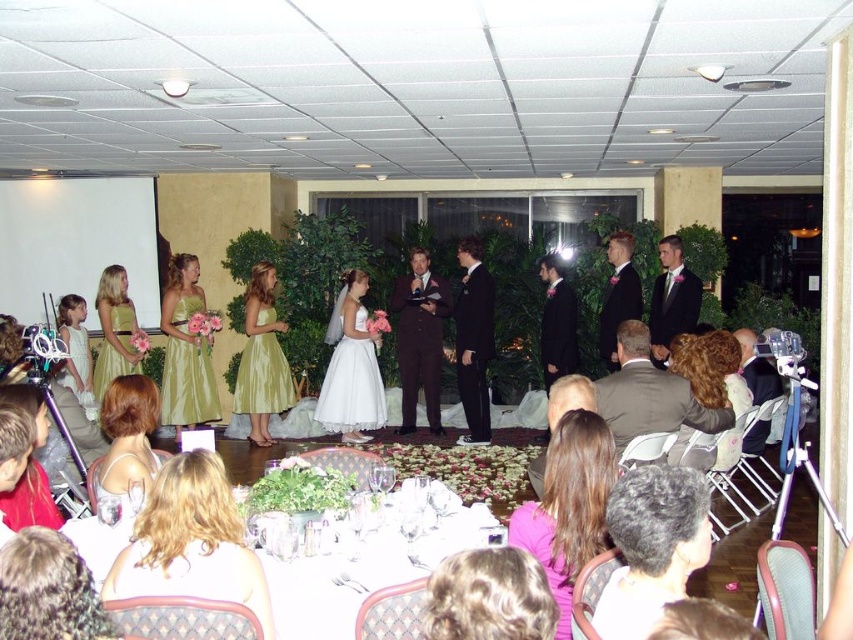
Which is below, matte black suit at center or shiny gold dress at center?

Positioned lower is shiny gold dress at center.

Which is more to the right, matte black suit at center or shiny gold dress at center?

Positioned to the right is matte black suit at center.

Does point (676, 288) come farther from viewer compared to point (102, 275)?

No.

This screenshot has height=640, width=853. I want to click on matte black suit at center, so click(672, 300).

Is blonde hair at lower center shorter than matte gray suit at center?

Indeed, blonde hair at lower center has a lesser height compared to matte gray suit at center.

Looking at this image, does blonde hair at lower center have a smaller size compared to matte gray suit at center?

Yes, blonde hair at lower center is smaller than matte gray suit at center.

Does point (228, 497) come closer to viewer compared to point (621, 385)?

Yes.

Where is `blonde hair at lower center`? blonde hair at lower center is located at coordinates (190, 541).

Which of these two, white glossy table at center or blonde hair at lower center, stands shorter?

Standing shorter between the two is white glossy table at center.

Is point (312, 572) positioned in front of point (251, 608)?

No, it is behind (251, 608).

Is point (291, 584) farther from camera compared to point (207, 524)?

That is True.

The height and width of the screenshot is (640, 853). In order to click on white glossy table at center in this screenshot , I will do `click(364, 557)`.